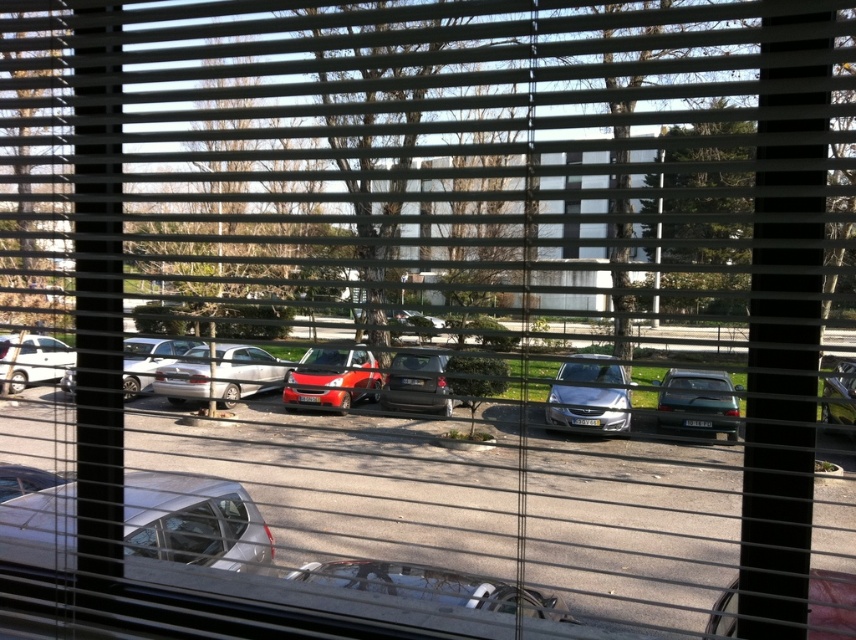
Question: Considering the relative positions of shiny dark green sedan at right and metallic silver car at center in the image provided, where is shiny dark green sedan at right located with respect to metallic silver car at center?

Choices:
 (A) right
 (B) left

Answer: (B)

Question: Among these objects, which one is farthest from the camera?

Choices:
 (A) matte black car at center
 (B) shiny red car at lower right
 (C) silver metallic car at lower left
 (D) satin silver sedan at center

Answer: (D)

Question: Which object is farther from the camera taking this photo?

Choices:
 (A) shiny dark green sedan at right
 (B) satin silver sedan at center
 (C) silver metallic car at lower left
 (D) white matte car at left

Answer: (D)

Question: Is shiny dark green sedan at right to the left of matte black car at center from the viewer's perspective?

Choices:
 (A) no
 (B) yes

Answer: (A)

Question: Among these objects, which one is nearest to the camera?

Choices:
 (A) white matte car at left
 (B) matte silver sedan at center
 (C) shiny dark green sedan at right
 (D) matte black car at center

Answer: (C)

Question: Does shiny red car at lower right have a larger size compared to matte silver sedan at center?

Choices:
 (A) yes
 (B) no

Answer: (B)